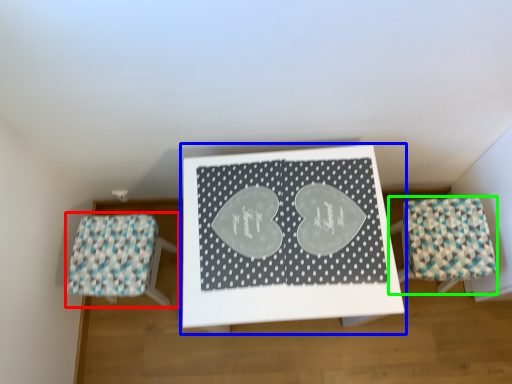
Question: Which object is positioned farthest from furniture (highlighted by a red box)? Select from table (highlighted by a blue box) and furniture (highlighted by a green box).

Choices:
 (A) table
 (B) furniture

Answer: (B)